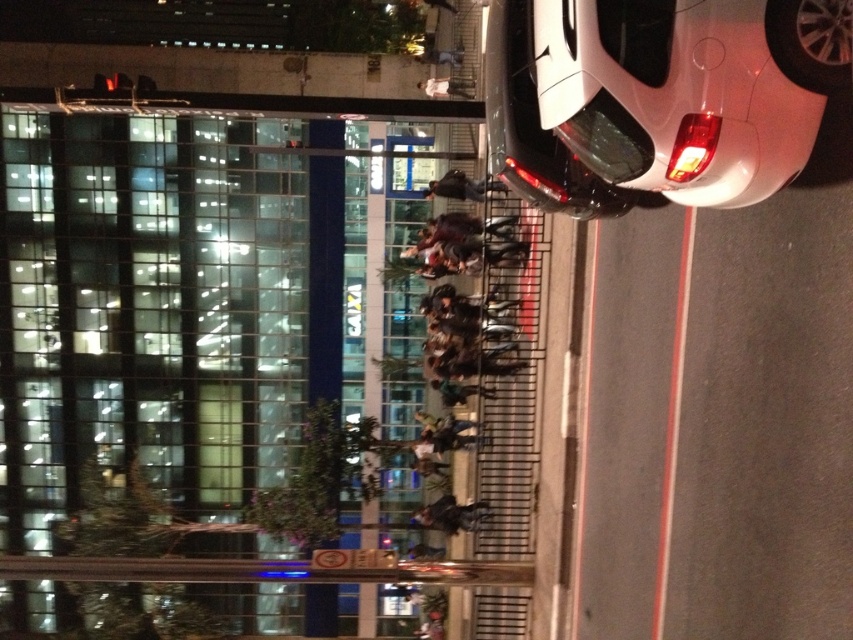
Question: Which of the following is the farthest from the observer?

Choices:
 (A) (221, 348)
 (B) (616, 132)

Answer: (A)

Question: Where is transparent glass building at upper left located in relation to white glossy car at right in the image?

Choices:
 (A) right
 (B) left

Answer: (B)

Question: Can you confirm if transparent glass building at upper left is wider than white glossy car at right?

Choices:
 (A) no
 (B) yes

Answer: (B)

Question: Which object appears farthest from the camera in this image?

Choices:
 (A) transparent glass building at upper left
 (B) white glossy car at right

Answer: (A)

Question: Which object is farther from the camera taking this photo?

Choices:
 (A) white glossy car at right
 (B) transparent glass building at upper left

Answer: (B)

Question: Can you confirm if transparent glass building at upper left is wider than white glossy car at right?

Choices:
 (A) no
 (B) yes

Answer: (B)